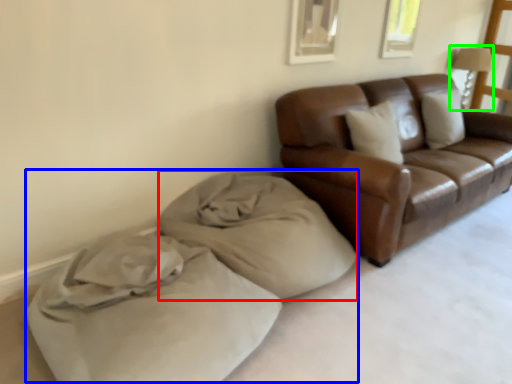
Question: Estimate the real-world distances between objects in this image. Which object is closer to material (highlighted by a red box), bed (highlighted by a blue box) or lamp (highlighted by a green box)?

Choices:
 (A) bed
 (B) lamp

Answer: (A)